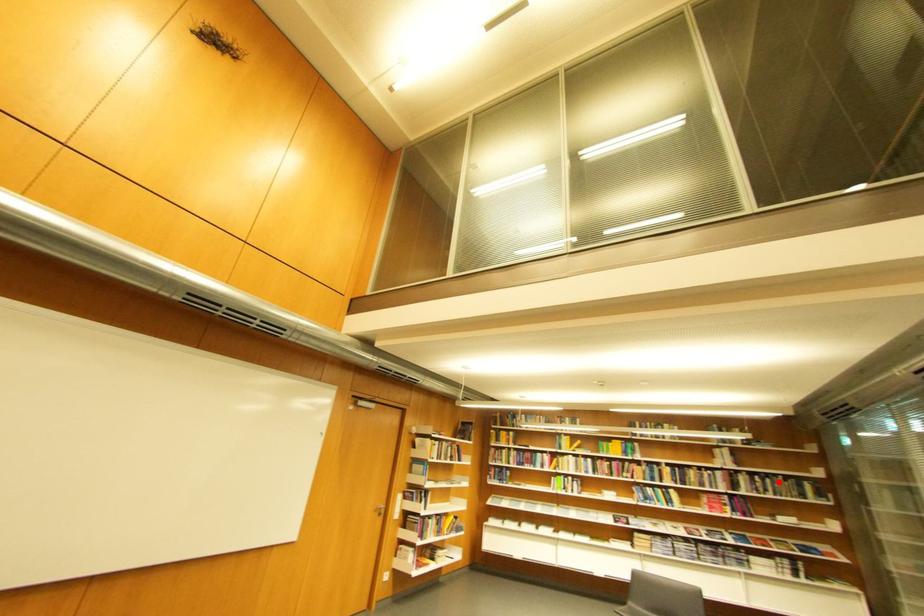
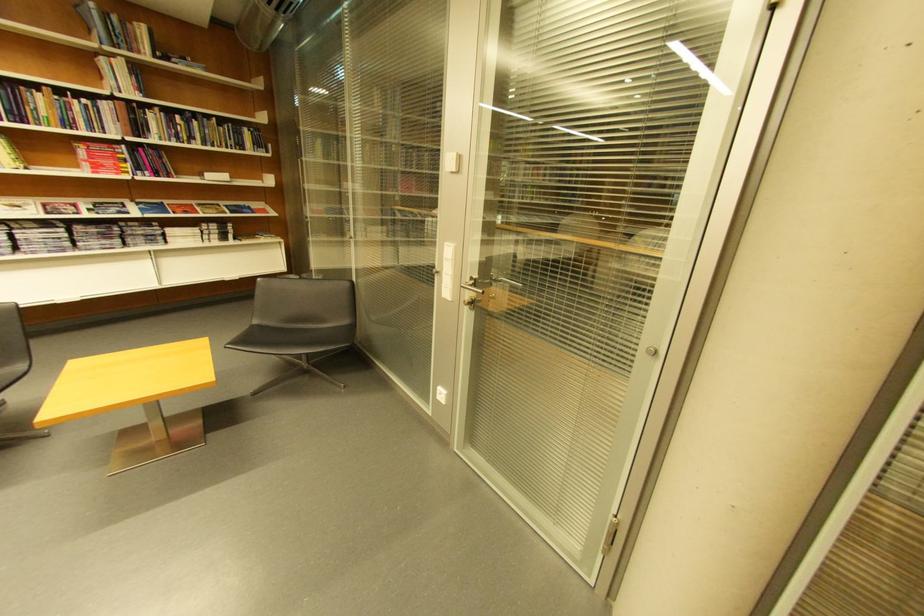
Question: I am providing you with two images of the same scene from different viewpoints. A red point is marked on the first image. Can you still see the location of the red point in image 2?

Choices:
 (A) Yes
 (B) No

Answer: (A)